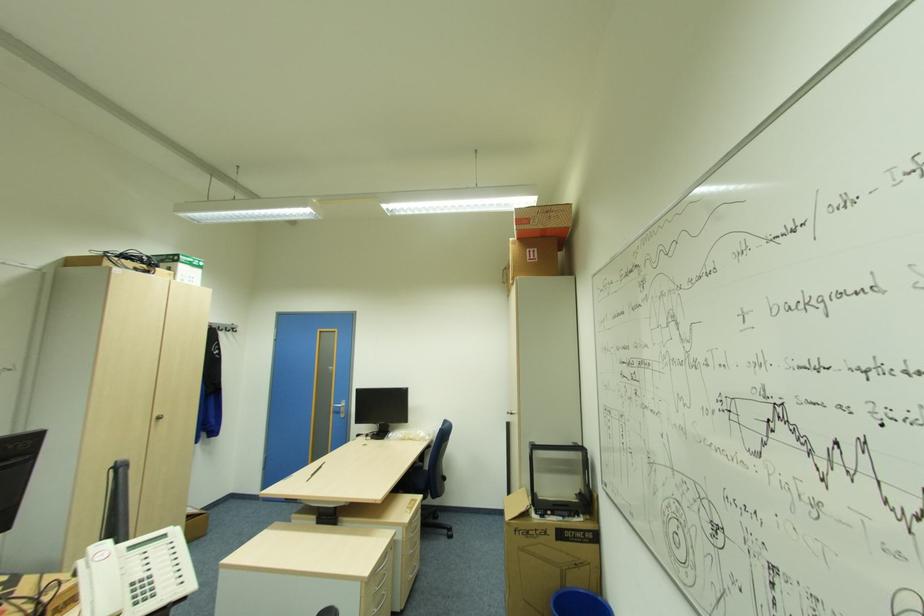
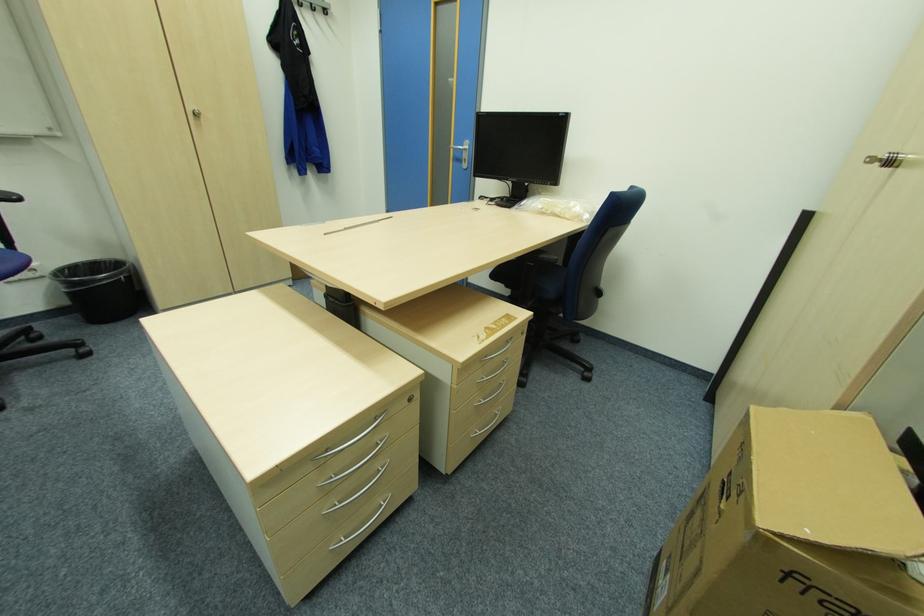
In the second image, find the point that corresponds to pixel 517 530 in the first image.

(789, 573)